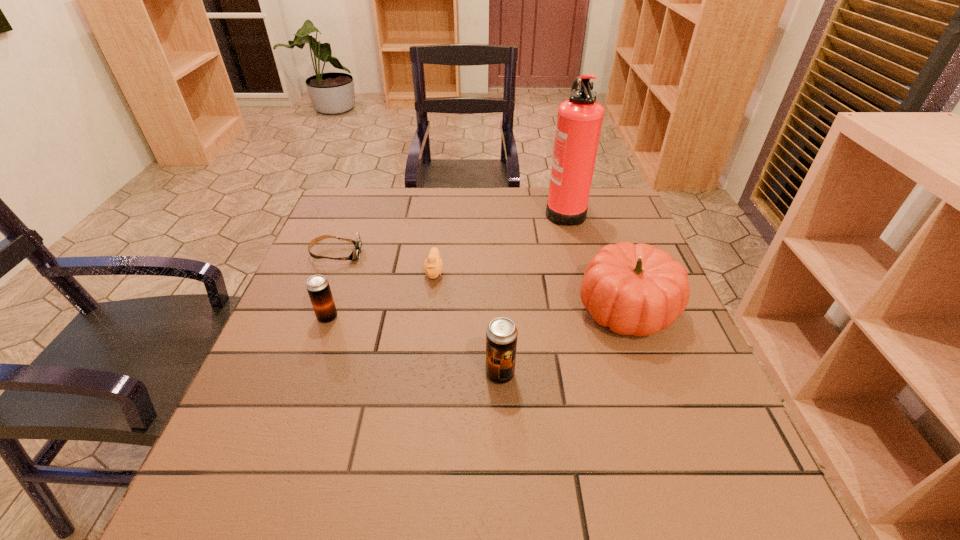
This screenshot has height=540, width=960. In order to click on the farther beer can in this screenshot , I will do `click(318, 287)`.

What are the coordinates of `the shorter beer can` in the screenshot? It's located at (318, 287).

At what (x,y) coordinates should I click in order to perform the action: click on the taller beer can. Please return your answer as a coordinate pair (x, y). Looking at the image, I should click on (501, 334).

Locate an element on the screen. The image size is (960, 540). the fourth object from left to right is located at coordinates (501, 334).

I want to click on the tallest object, so click(x=579, y=121).

I want to click on fire extinguisher, so click(579, 121).

This screenshot has width=960, height=540. I want to click on pumpkin, so click(634, 289).

Image resolution: width=960 pixels, height=540 pixels. I want to click on goggles, so click(x=355, y=254).

This screenshot has width=960, height=540. What are the coordinates of `the second shortest object` in the screenshot? It's located at tap(433, 265).

This screenshot has height=540, width=960. What are the coordinates of `duckling` in the screenshot? It's located at (433, 265).